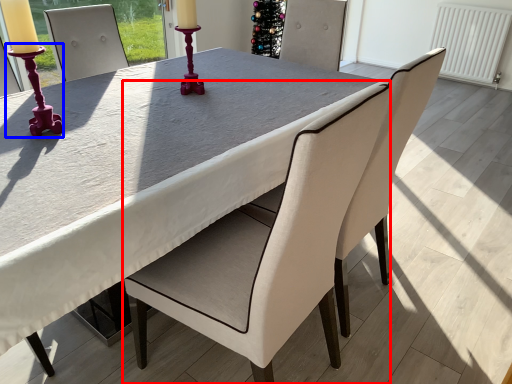
Question: Which object appears closest to the camera in this image, chair (highlighted by a red box) or candle holder (highlighted by a blue box)?

Choices:
 (A) chair
 (B) candle holder

Answer: (A)